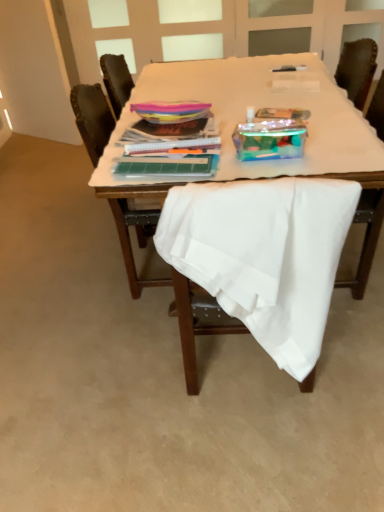
Question: Relative to white fabric chair at center, marked as the 2th chair in a back-to-front arrangement, is wooden chair at center, acting as the second chair starting from the front, in front or behind?

Choices:
 (A) behind
 (B) front

Answer: (A)

Question: From the image's perspective, is wooden chair at center, placed as the 1th chair when sorted from back to front, located above or below white fabric chair at center, the 1th chair viewed from the front?

Choices:
 (A) below
 (B) above

Answer: (B)

Question: Estimate the real-world distances between objects in this image. Which object is closer to the white fabric-covered table at center?

Choices:
 (A) wooden chair at center, placed as the 1th chair when sorted from back to front
 (B) white fabric-covered table at center
 (C) white fabric chair at center, marked as the 2th chair in a back-to-front arrangement

Answer: (B)

Question: Which object is the closest to the wooden chair at center, placed as the 1th chair when sorted from back to front?

Choices:
 (A) white fabric chair at center, the 1th chair viewed from the front
 (B) white fabric-covered table at center
 (C) white fabric-covered table at center

Answer: (C)